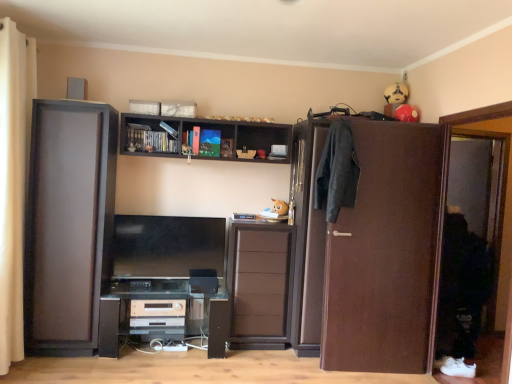
I want to click on free space above brown wooden screen door at right (from a real-world perspective), so click(477, 106).